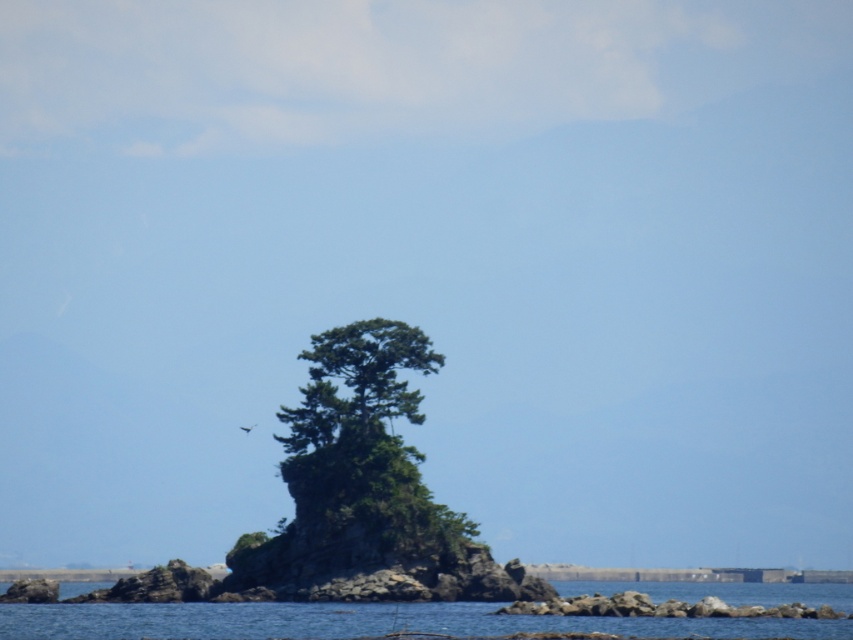
Consider the image. Is green leafy tree at center to the right of blue water at center from the viewer's perspective?

Incorrect, green leafy tree at center is not on the right side of blue water at center.

Does green leafy tree at center have a larger size compared to blue water at center?

Incorrect, green leafy tree at center is not larger than blue water at center.

Who is more distant from viewer, (398, 403) or (90, 604)?

The point (90, 604) is more distant.

Find the location of a particular element. This screenshot has width=853, height=640. green leafy tree at center is located at coordinates (364, 444).